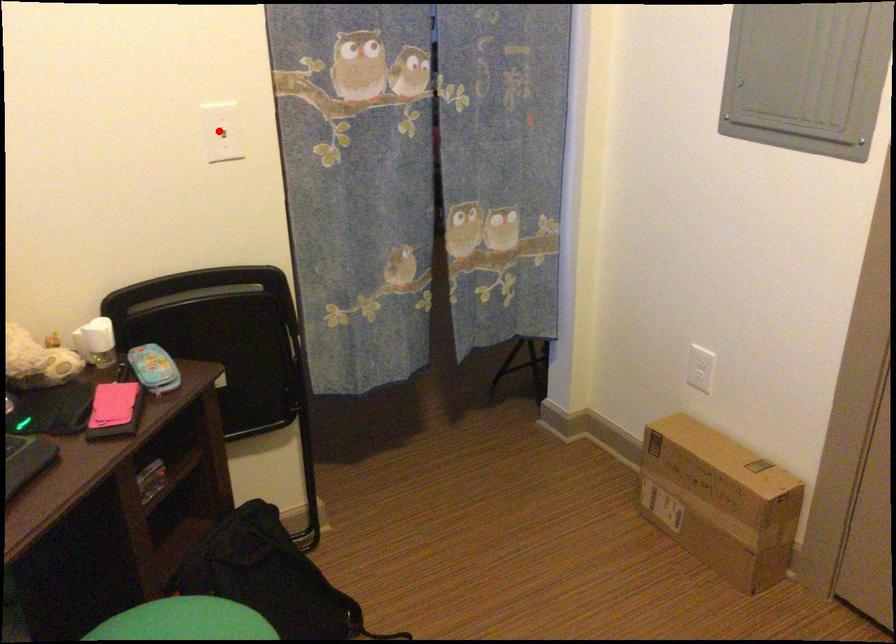
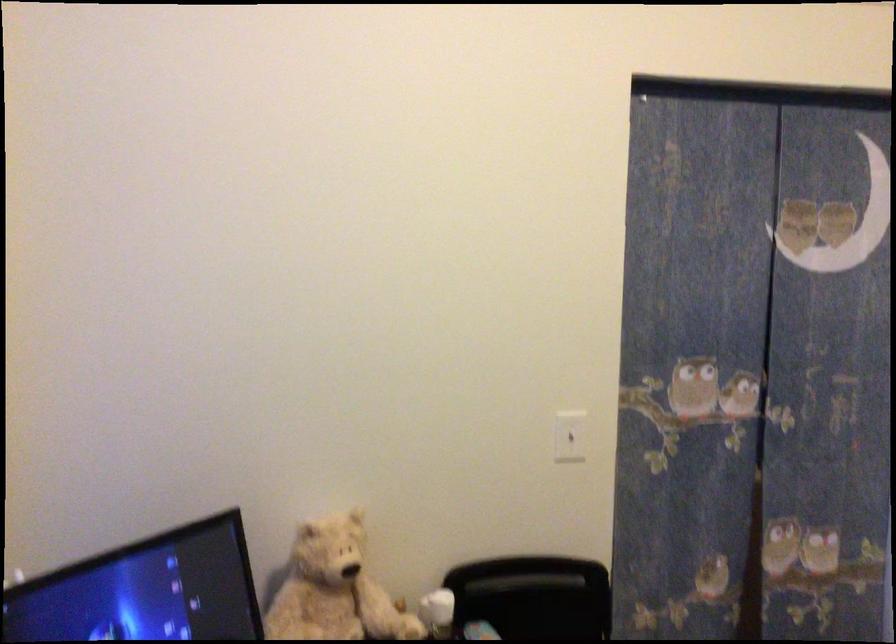
In the second image, find the point that corresponds to the highlighted location in the first image.

(570, 436)